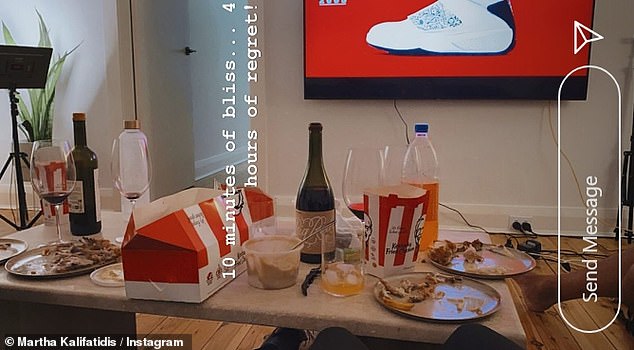
Locate an element on the screen. Image resolution: width=634 pixels, height=350 pixels. wine glasses is located at coordinates (56, 180), (133, 164), (358, 173), (411, 158).